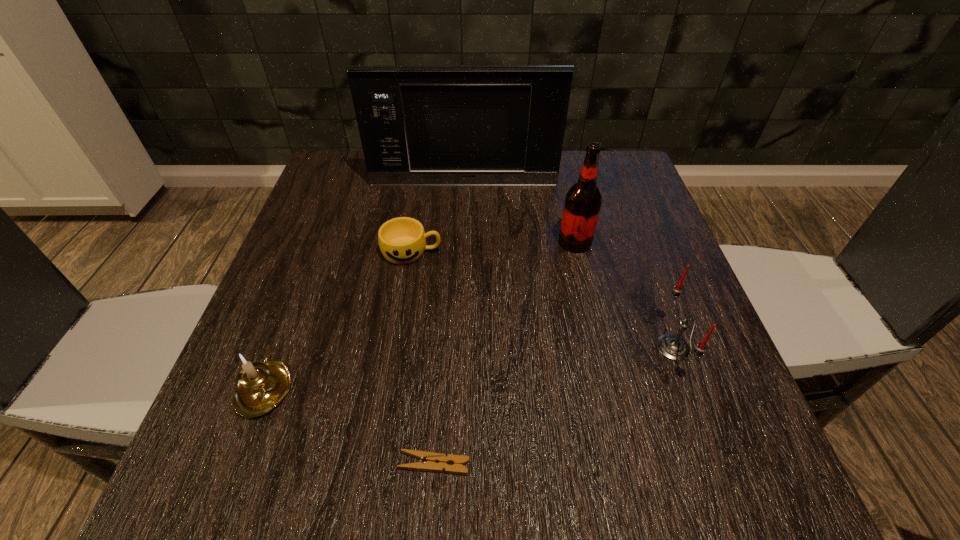
This screenshot has width=960, height=540. I want to click on microwave oven, so click(x=475, y=125).

Find the location of `the farthest object`. the farthest object is located at coordinates (475, 125).

Find the location of a particular element. The width and height of the screenshot is (960, 540). the second tallest object is located at coordinates (583, 200).

Identify the location of candle. (673, 347).

Identify the location of the rightmost object. This screenshot has height=540, width=960. (673, 347).

At what (x,y) coordinates should I click in order to perform the action: click on the leftmost object. Please return your answer as a coordinate pair (x, y). Looking at the image, I should click on (263, 385).

Locate an element on the screen. The height and width of the screenshot is (540, 960). candle holder is located at coordinates (263, 385).

The height and width of the screenshot is (540, 960). What are the coordinates of `cup` in the screenshot? It's located at click(402, 240).

At what (x,y) coordinates should I click in order to perform the action: click on the nearest object. Please return your answer as a coordinate pair (x, y). This screenshot has width=960, height=540. Looking at the image, I should click on (431, 458).

The height and width of the screenshot is (540, 960). I want to click on the shortest object, so click(x=431, y=458).